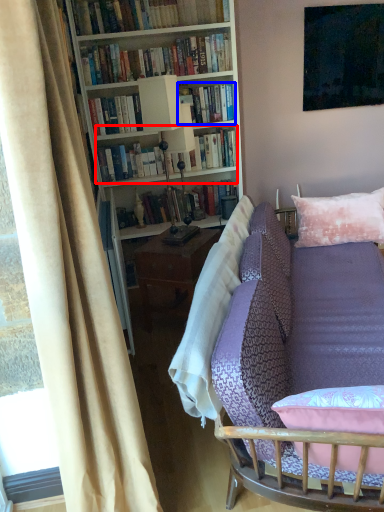
Question: Which object is further to the camera taking this photo, book (highlighted by a red box) or book (highlighted by a blue box)?

Choices:
 (A) book
 (B) book

Answer: (A)